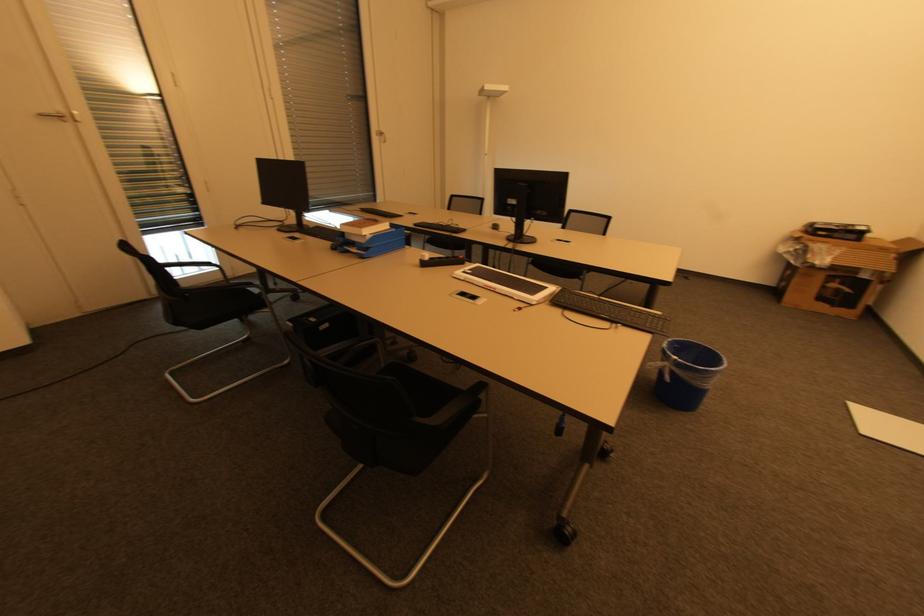
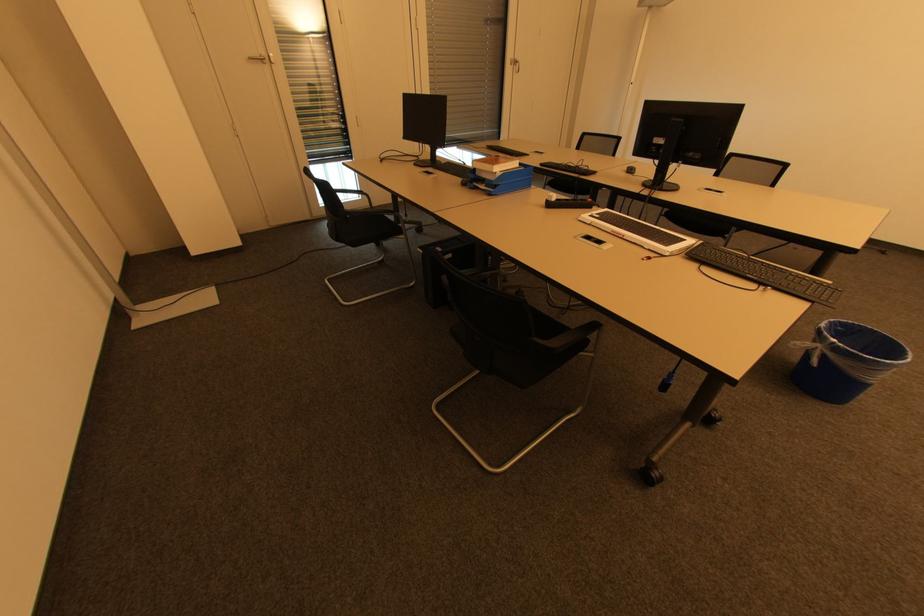
Where in the second image is the point corresponding to pixel 677 359 from the first image?

(835, 341)